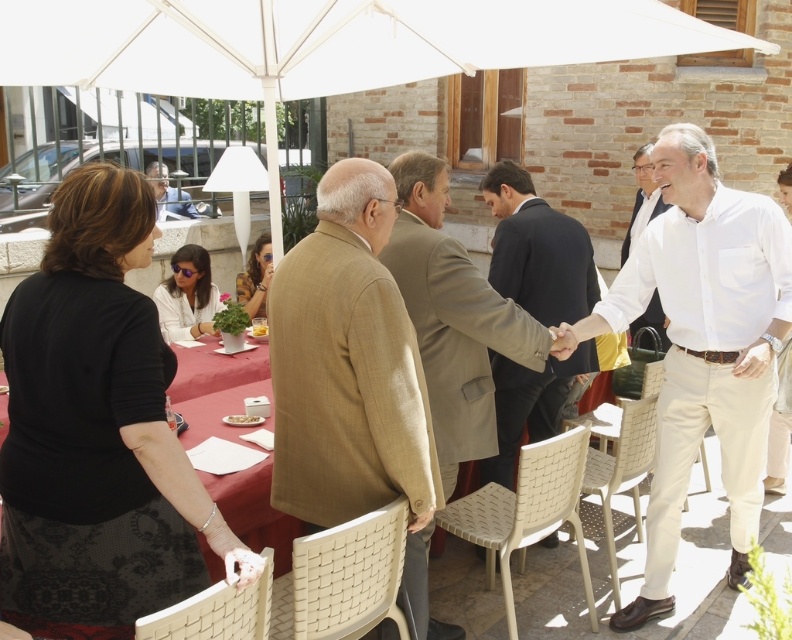
Question: Estimate the real-world distances between objects in this image. Which object is farther from the yellow crumbly cake at table?

Choices:
 (A) light brown suit at center
 (B) white cotton shirt at upper right
 (C) matte black suit at upper left
 (D) white cotton shirt at center

Answer: (B)

Question: Which object is the closest to the white matte plate at center?

Choices:
 (A) matte white shirt at center
 (B) tan wool blazer at center
 (C) matte black dress at center
 (D) matte black suit at upper left

Answer: (B)

Question: Which point is farther to the camera?

Choices:
 (A) matte black suit at upper left
 (B) yellow crumbly cake at table
 (C) black lace dress at lower left
 (D) matte black dress at center

Answer: (A)

Question: Does light brown suit at center come in front of matte white shirt at center?

Choices:
 (A) no
 (B) yes

Answer: (B)

Question: Can you confirm if matte black dress at center is positioned above white cotton shirt at upper right?

Choices:
 (A) yes
 (B) no

Answer: (B)

Question: Is tan wool blazer at center to the right of matte black suit at upper left from the viewer's perspective?

Choices:
 (A) no
 (B) yes

Answer: (B)